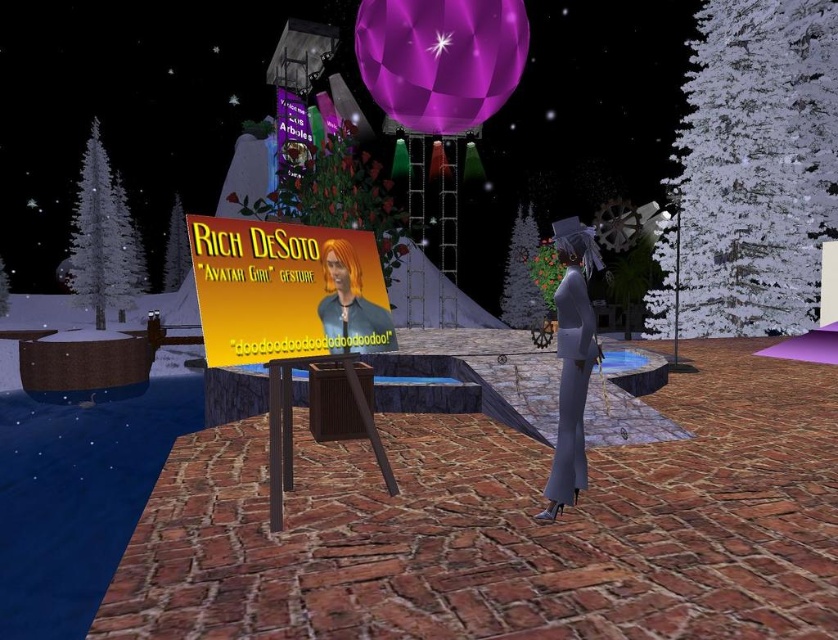
Question: Which of the following is the farthest from the observer?

Choices:
 (A) smooth plastic poster at center
 (B) matte white suit at right

Answer: (A)

Question: Does matte white suit at right have a larger size compared to smooth plastic poster at center?

Choices:
 (A) yes
 (B) no

Answer: (A)

Question: Is matte white suit at right closer to camera compared to smooth plastic poster at center?

Choices:
 (A) no
 (B) yes

Answer: (B)

Question: Among these points, which one is nearest to the camera?

Choices:
 (A) (561, 440)
 (B) (361, 308)

Answer: (A)

Question: In this image, where is matte white suit at right located relative to smooth plastic poster at center?

Choices:
 (A) above
 (B) below

Answer: (B)